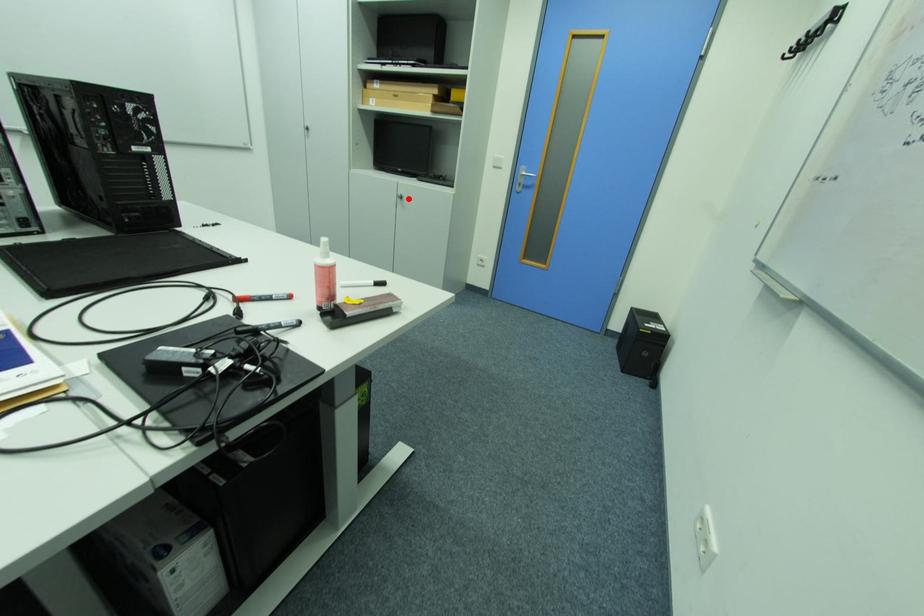
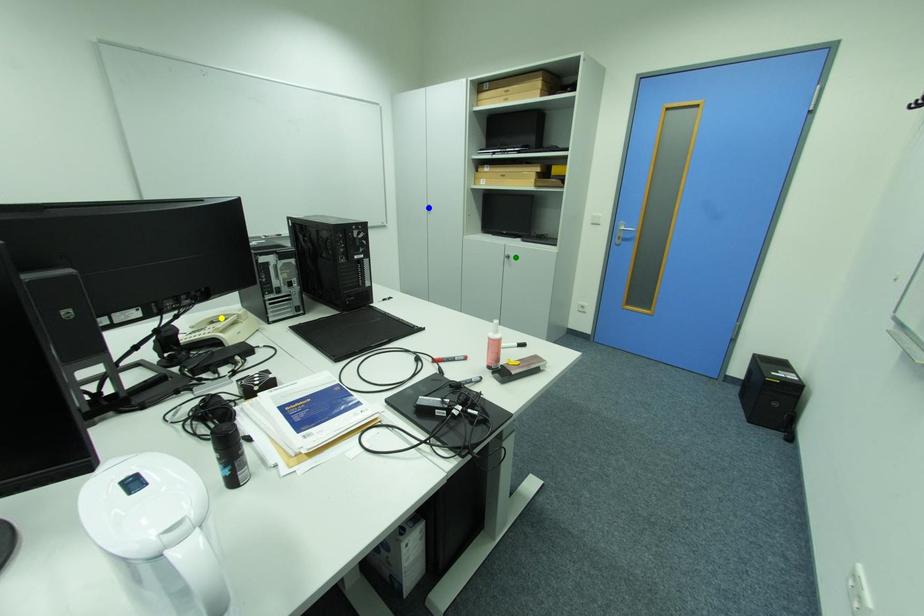
Question: I am providing you with two images of the same scene from different viewpoints. A red point is marked on the first image. You are given multiple points on the second image. Which spot in image 2 lines up with the point in image 1?

Choices:
 (A) blue point
 (B) green point
 (C) yellow point

Answer: (B)